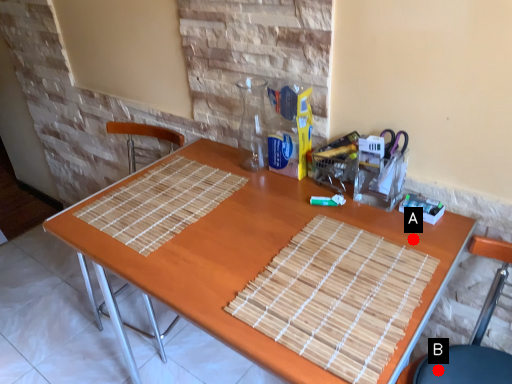
Question: Two points are circled on the image, labeled by A and B beside each circle. Among these points, which one is farthest from the camera?

Choices:
 (A) A is further
 (B) B is further

Answer: (A)